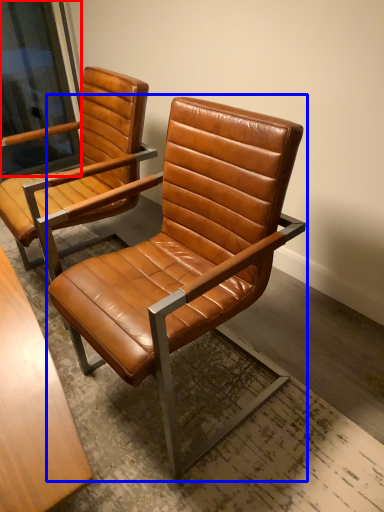
Question: Among these objects, which one is farthest to the camera, window screen (highlighted by a red box) or chair (highlighted by a blue box)?

Choices:
 (A) window screen
 (B) chair

Answer: (A)